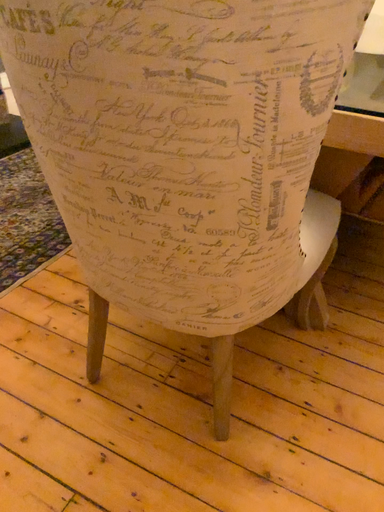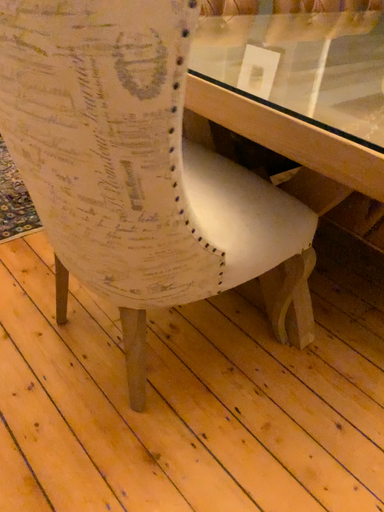
Question: How did the camera likely rotate when shooting the video?

Choices:
 (A) rotated right
 (B) rotated left

Answer: (B)